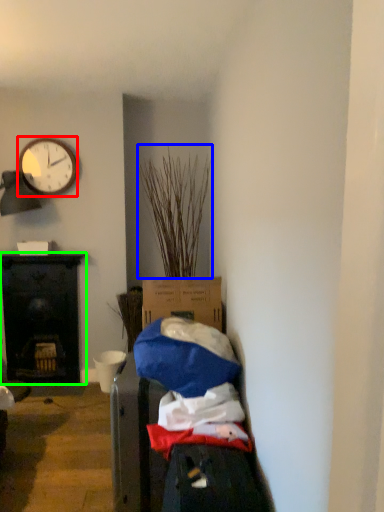
Question: Estimate the real-world distances between objects in this image. Which object is farther from clock (highlighted by a red box), plant (highlighted by a blue box) or desk (highlighted by a green box)?

Choices:
 (A) plant
 (B) desk

Answer: (B)